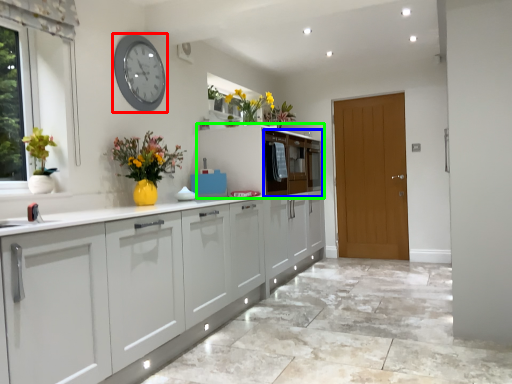
Question: Which object is the farthest from clock (highlighted by a red box)? Choose among these: drawer (highlighted by a blue box) or cabinetry (highlighted by a green box).

Choices:
 (A) drawer
 (B) cabinetry

Answer: (A)